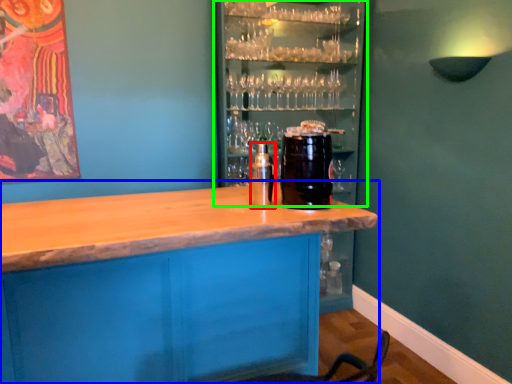
Question: Estimate the real-world distances between objects in this image. Which object is farther from beverage (highlighted by a red box), table (highlighted by a blue box) or shelf (highlighted by a green box)?

Choices:
 (A) table
 (B) shelf

Answer: (B)